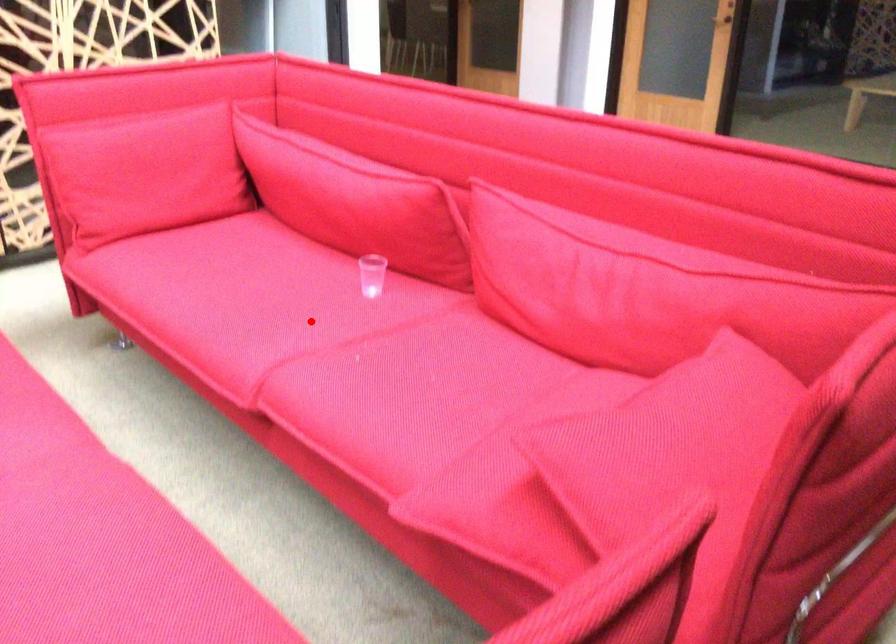
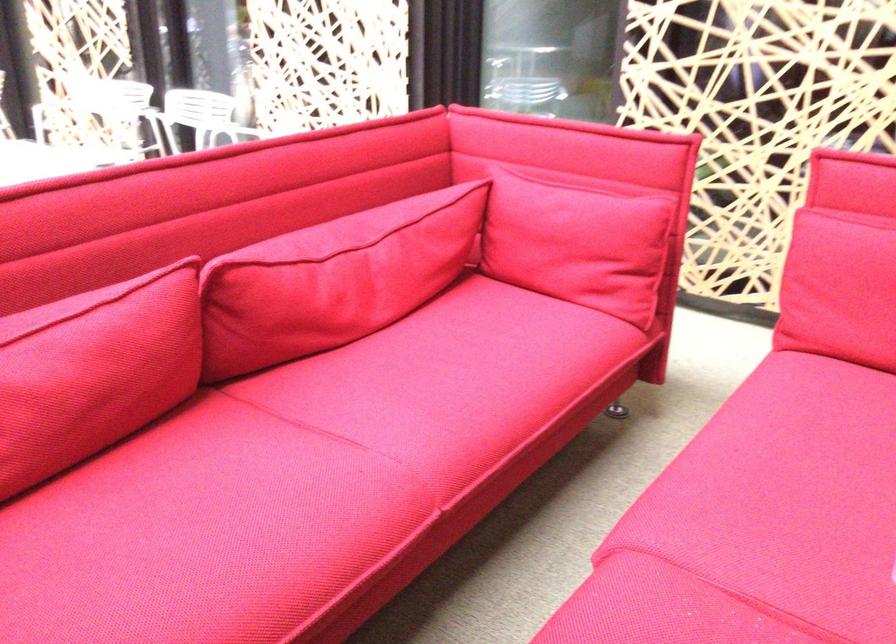
Question: I am providing you with two images of the same scene from different viewpoints. In image1, a red point is highlighted. Considering the same 3D point in image2, which of the following is correct?

Choices:
 (A) It is closer
 (B) It is farther

Answer: (A)